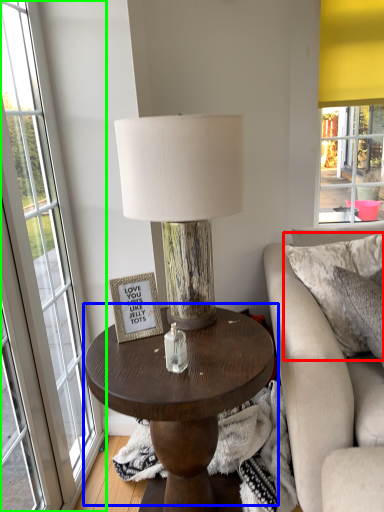
Question: Based on their relative distances, which object is nearer to pillow (highlighted by a red box)? Choose from coffee table (highlighted by a blue box) and window (highlighted by a green box).

Choices:
 (A) coffee table
 (B) window

Answer: (A)